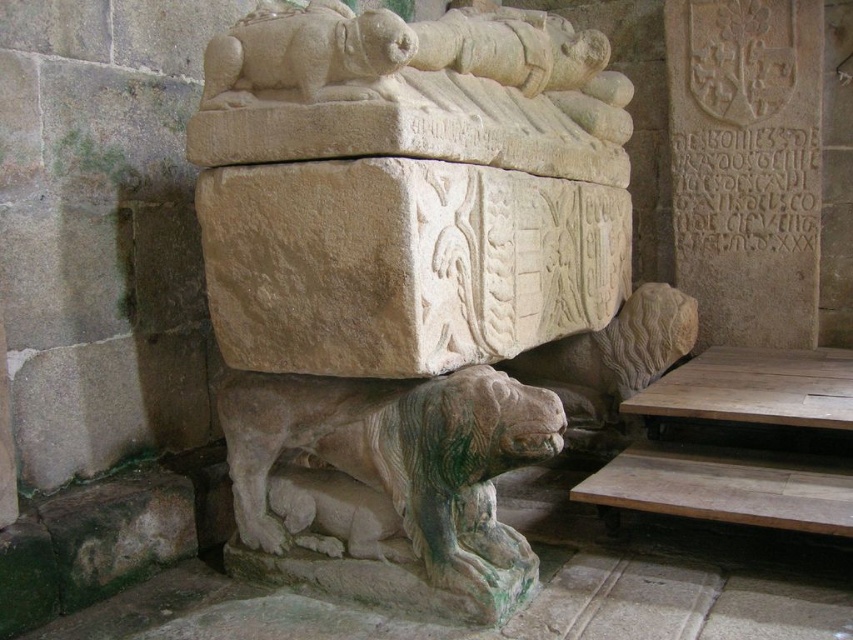
You are an archaeologist examining the historical site depicted in the image. You need to document the exact position of the stone lion statue at center relative to the sarcophagus. Can you determine if the lion is positioned at the base of the sarcophagus?

The stone lion statue at center is located at point (415,288), which corresponds to the base of the sarcophagus, so yes, it is positioned at the base of the sarcophagus.

You are standing in front of the historical site and want to take a photo of the stone lion statue at center without including any other objects in the frame. Given that your camera has a focal length of 50mm and you want to ensure the lion fills the frame properly, what is the minimum distance you need to be from the statue?

The stone lion statue at center is 1.80 meters away from the camera. To ensure proper framing with a 50mm lens, you should maintain this distance as it aligns with standard focal length recommendations for capturing such subjects without distortion.

You are an archaeologist examining the tomb and notice two stone lions. The green stone lion at lower left and the stone lion at upper center. Which lion is taller?

The green stone lion at lower left is much taller than the stone lion at upper center.